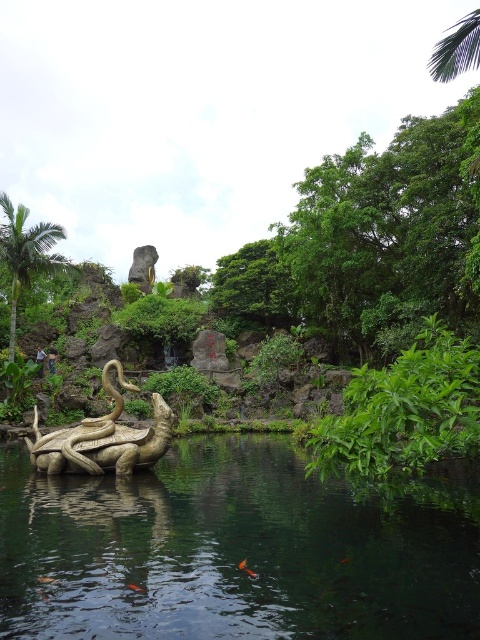
Question: Is green leafy plant at center smaller than shiny bronze octopus at center?

Choices:
 (A) yes
 (B) no

Answer: (B)

Question: Among these objects, which one is nearest to the camera?

Choices:
 (A) green leafy plant at center
 (B) green leafy tree at upper right

Answer: (A)

Question: Is shiny bronze octopus at center below green leafy tree at upper left?

Choices:
 (A) yes
 (B) no

Answer: (A)

Question: Does transparent water at center have a lesser width compared to green leafy tree at upper left?

Choices:
 (A) yes
 (B) no

Answer: (B)

Question: Which object appears closest to the camera in this image?

Choices:
 (A) green leafy plant at center
 (B) green leafy tree at upper left
 (C) orange glossy fish at lower center
 (D) shiny bronze octopus at center

Answer: (A)

Question: Which point is closer to the camera?

Choices:
 (A) green leafy plant at center
 (B) orange glossy fish at lower center

Answer: (A)